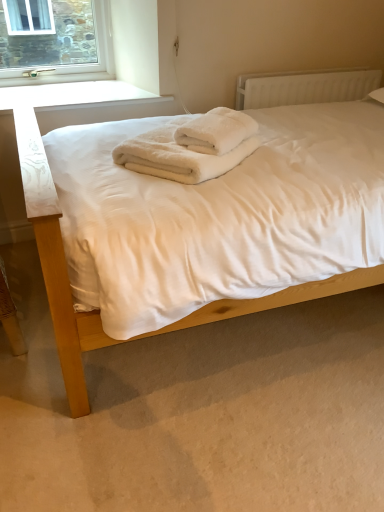
Question: Can we say white fluffy towels at center lies outside white plastic radiator at upper right?

Choices:
 (A) yes
 (B) no

Answer: (A)

Question: From the image's perspective, is white fluffy towels at center below white plastic radiator at upper right?

Choices:
 (A) no
 (B) yes

Answer: (B)

Question: Considering the relative sizes of white fluffy towels at center and white plastic radiator at upper right in the image provided, is white fluffy towels at center bigger than white plastic radiator at upper right?

Choices:
 (A) no
 (B) yes

Answer: (A)

Question: Is white fluffy towels at center to the right of white plastic radiator at upper right from the viewer's perspective?

Choices:
 (A) yes
 (B) no

Answer: (B)

Question: Is white fluffy towels at center surrounding white plastic radiator at upper right?

Choices:
 (A) yes
 (B) no

Answer: (B)

Question: Is the position of white fluffy towels at center less distant than that of white plastic radiator at upper right?

Choices:
 (A) yes
 (B) no

Answer: (A)

Question: From the image's perspective, is white soft bed at center on white plastic radiator at upper right?

Choices:
 (A) no
 (B) yes

Answer: (A)

Question: From the image's perspective, would you say white soft bed at center is shown under white plastic radiator at upper right?

Choices:
 (A) yes
 (B) no

Answer: (A)

Question: Considering the relative positions of white soft bed at center and white plastic radiator at upper right in the image provided, is white soft bed at center to the left of white plastic radiator at upper right from the viewer's perspective?

Choices:
 (A) no
 (B) yes

Answer: (B)

Question: Considering the relative sizes of white soft bed at center and white plastic radiator at upper right in the image provided, is white soft bed at center taller than white plastic radiator at upper right?

Choices:
 (A) yes
 (B) no

Answer: (A)

Question: Is white soft bed at center directly adjacent to white plastic radiator at upper right?

Choices:
 (A) yes
 (B) no

Answer: (B)

Question: Is white soft bed at center looking in the opposite direction of white plastic radiator at upper right?

Choices:
 (A) no
 (B) yes

Answer: (B)

Question: From a real-world perspective, does white plastic radiator at upper right sit lower than white fluffy towels at center?

Choices:
 (A) no
 (B) yes

Answer: (B)